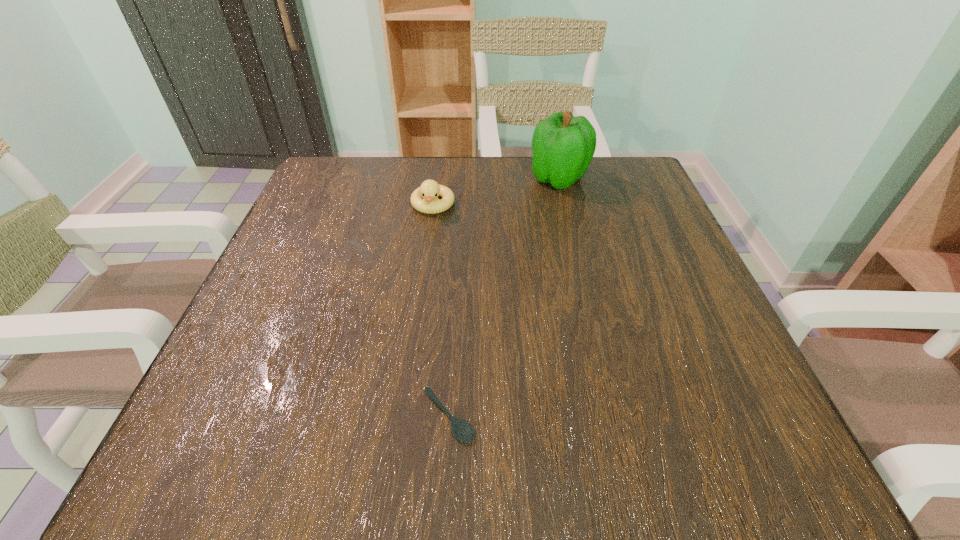
At what (x,y) coordinates should I click in order to perform the action: click on vacant area at the near right corner of the desktop. Please return your answer as a coordinate pair (x, y). Looking at the image, I should click on (731, 415).

The image size is (960, 540). I want to click on free space between the second tallest object and the rightmost object, so click(495, 192).

The height and width of the screenshot is (540, 960). Identify the location of empty space between the bell pepper and the nearest object. (504, 298).

Locate an element on the screen. The width and height of the screenshot is (960, 540). free spot between the second shortest object and the shortest object is located at coordinates (441, 311).

This screenshot has width=960, height=540. Identify the location of unoccupied area between the bell pepper and the second shortest object. (495, 192).

The width and height of the screenshot is (960, 540). I want to click on vacant space that's between the second tallest object and the shortest object, so click(441, 311).

Where is `vacant space that is in between the second tallest object and the soupspoon`? The image size is (960, 540). vacant space that is in between the second tallest object and the soupspoon is located at coordinates (441, 311).

What are the coordinates of `free space between the duckling and the bell pepper` in the screenshot? It's located at (495, 192).

What are the coordinates of `vacant point located between the soupspoon and the second tallest object` in the screenshot? It's located at (441, 311).

This screenshot has height=540, width=960. What are the coordinates of `free space between the nearest object and the bell pepper` in the screenshot? It's located at (504, 298).